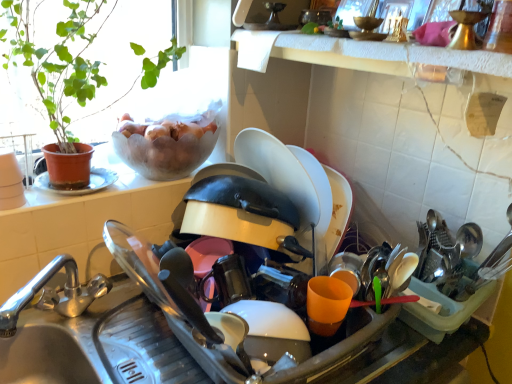
Question: From the image's perspective, is white textured towel at upper center under matte white sink at center?

Choices:
 (A) no
 (B) yes

Answer: (A)

Question: Can you confirm if white textured towel at upper center is shorter than matte white sink at center?

Choices:
 (A) no
 (B) yes

Answer: (B)

Question: Does white textured towel at upper center have a larger size compared to matte white sink at center?

Choices:
 (A) yes
 (B) no

Answer: (B)

Question: Is matte white sink at center a part of white textured towel at upper center?

Choices:
 (A) yes
 (B) no

Answer: (B)

Question: Does white textured towel at upper center have a lesser width compared to matte white sink at center?

Choices:
 (A) yes
 (B) no

Answer: (A)

Question: Is white textured towel at upper center taller than matte white sink at center?

Choices:
 (A) no
 (B) yes

Answer: (A)

Question: Does matte white sink at center have a lesser width compared to white textured towel at upper center?

Choices:
 (A) no
 (B) yes

Answer: (A)

Question: From a real-world perspective, is matte white sink at center positioned over white textured towel at upper center based on gravity?

Choices:
 (A) no
 (B) yes

Answer: (A)

Question: Considering the relative sizes of matte white sink at center and white textured towel at upper center in the image provided, is matte white sink at center taller than white textured towel at upper center?

Choices:
 (A) yes
 (B) no

Answer: (A)

Question: Is matte white sink at center at the right side of white textured towel at upper center?

Choices:
 (A) no
 (B) yes

Answer: (A)

Question: Is matte white sink at center at the left side of white textured towel at upper center?

Choices:
 (A) yes
 (B) no

Answer: (A)

Question: Does matte white sink at center have a larger size compared to white textured towel at upper center?

Choices:
 (A) yes
 (B) no

Answer: (A)

Question: Considering the positions of white textured towel at upper center and matte white sink at center in the image, is white textured towel at upper center wider or thinner than matte white sink at center?

Choices:
 (A) wide
 (B) thin

Answer: (B)